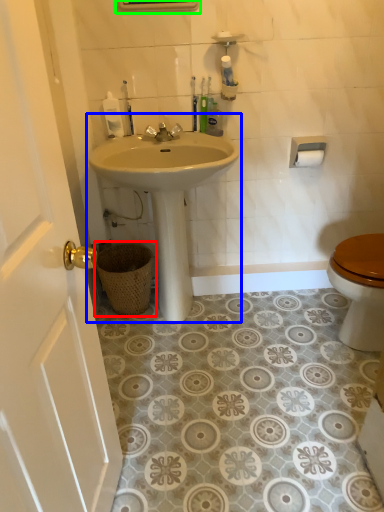
Question: Which is farther away from basket (highlighted by a red box)? sink (highlighted by a blue box) or medicine cabinet (highlighted by a green box)?

Choices:
 (A) sink
 (B) medicine cabinet

Answer: (B)